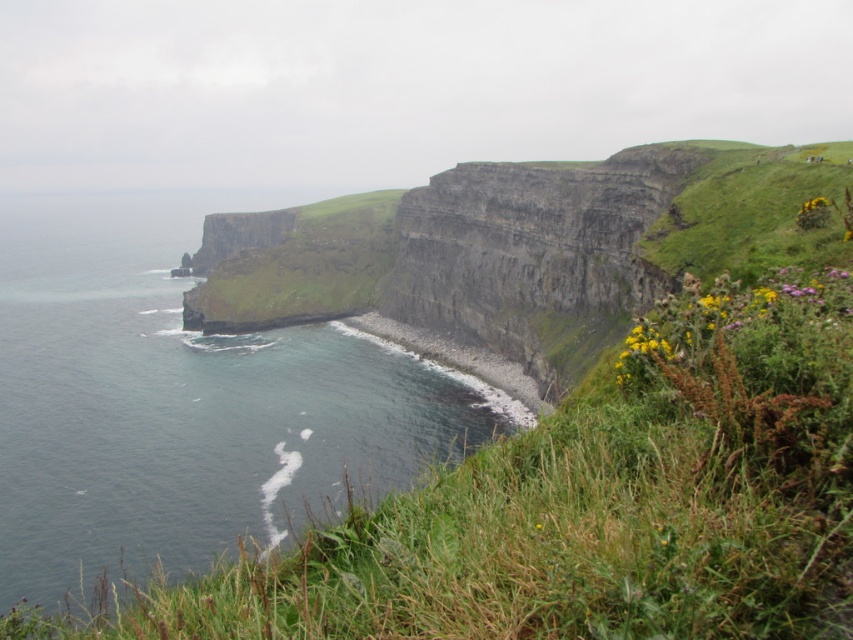
You are standing at the edge of the cliffs in the image and notice a point marked at coordinates (184, 403). Based on the scene description, what does this point most likely represent?

The point at (184, 403) most likely represents dark blue water at left as indicated by the Objects Description.

In the scene shown: You are standing on the cliff and looking down at the dark blue water at left and the gray rocky shoreline at lower left. Which one is higher from your perspective?

The dark blue water at left is above the gray rocky shoreline at lower left, so it is higher from your perspective.